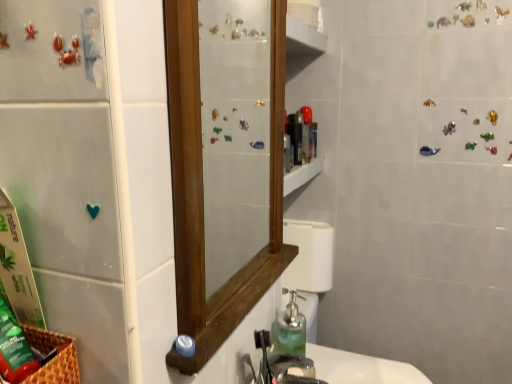
Question: In the image, is translucent plastic container at upper center on the left side or the right side of translucent glass soap dispenser at lower center?

Choices:
 (A) right
 (B) left

Answer: (A)

Question: From their relative heights in the image, would you say translucent plastic container at upper center is taller or shorter than translucent glass soap dispenser at lower center?

Choices:
 (A) tall
 (B) short

Answer: (A)

Question: Based on their relative distances, which object is farther from the translucent plastic container at upper center?

Choices:
 (A) white glossy sink at lower center, which is the first sink in back-to-front order
 (B) metallic silver faucet at sink center
 (C) translucent glass soap dispenser at lower center
 (D) white glossy sink at lower center, the 1th sink positioned from the front
 (E) wooden mirror at center

Answer: (B)

Question: Estimate the real-world distances between objects in this image. Which object is farther from the translucent glass soap dispenser at lower center?

Choices:
 (A) white glossy sink at lower center, the 2th sink positioned from the back
 (B) white glossy sink at lower center, the 2th sink from the front
 (C) translucent plastic container at upper center
 (D) wooden mirror at center
 (E) metallic silver faucet at sink center

Answer: (D)